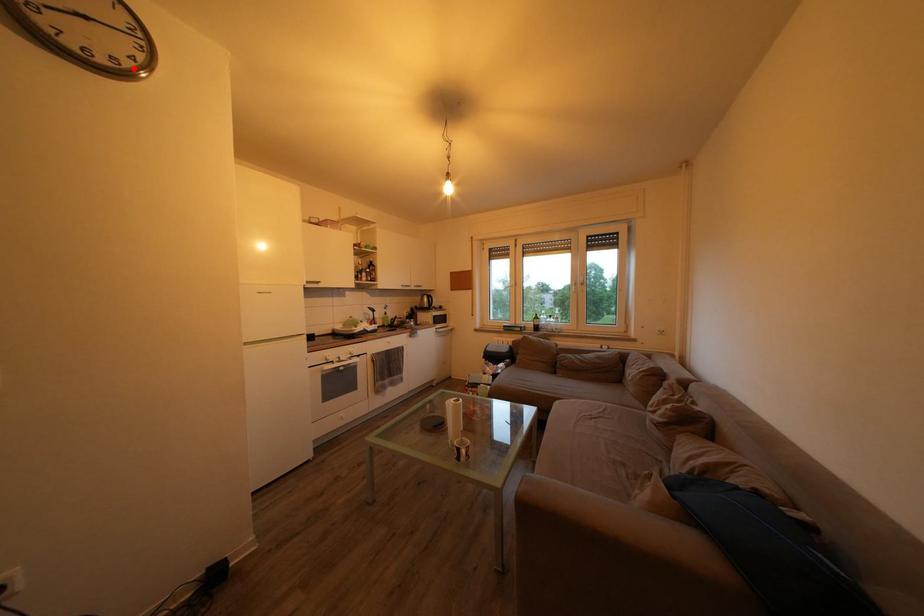
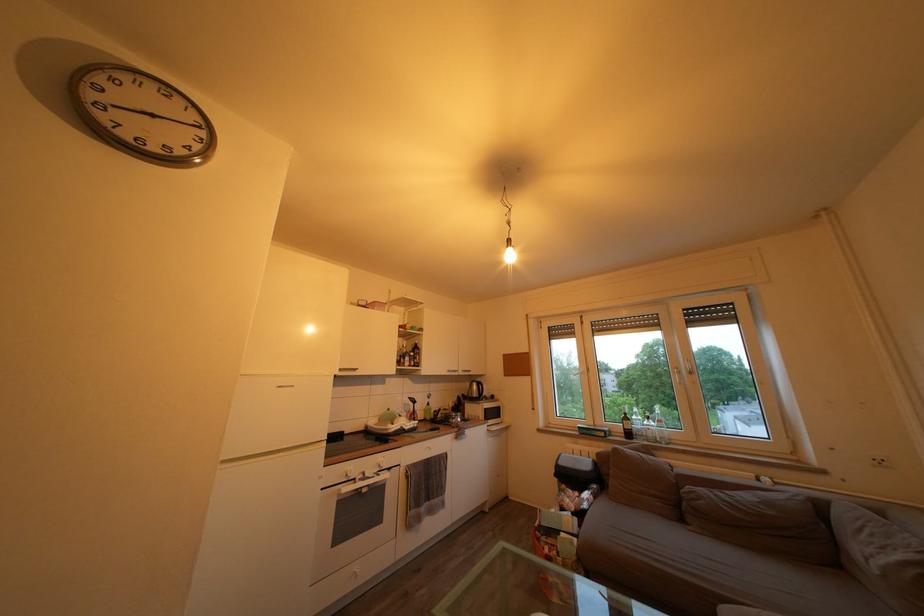
Question: I am providing you with two images of the same scene from different viewpoints. A red point is marked on the first image. Can you still see the location of the red point in image 2?

Choices:
 (A) Yes
 (B) No

Answer: (A)